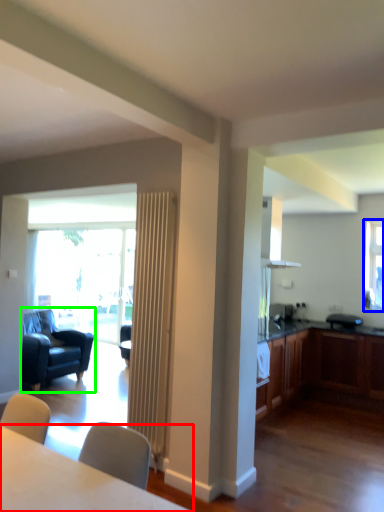
Question: Based on their relative distances, which object is nearer to table (highlighted by a red box)? Choose from window (highlighted by a blue box) and chair (highlighted by a green box).

Choices:
 (A) window
 (B) chair

Answer: (B)